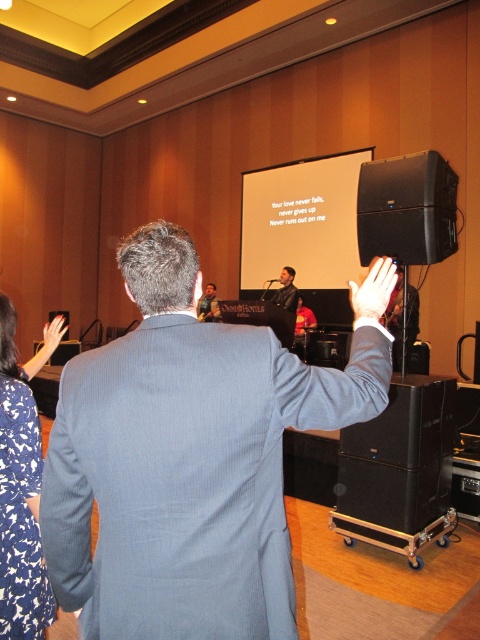
Is black matte speaker at lower right in front of matte black hand at upper left?

No, it is behind matte black hand at upper left.

Is black matte speaker at lower right to the right of matte black hand at upper left from the viewer's perspective?

Correct, you'll find black matte speaker at lower right to the right of matte black hand at upper left.

You are a GUI agent. You are given a task and a screenshot of the screen. Output one action in this format:
    pyautogui.click(x=<x>, y=<y>)
    Task: Click on the black matte speaker at lower right
    The height and width of the screenshot is (640, 480).
    Given the screenshot: What is the action you would take?
    pyautogui.click(x=407, y=209)

I want to click on black matte speaker at lower right, so click(x=407, y=209).

Is point (363, 200) positioned after point (271, 300)?

That is False.

Where is `black matte speaker at lower right`? This screenshot has height=640, width=480. black matte speaker at lower right is located at coordinates (407, 209).

Does blue pinstripe suit at center have a greater height compared to blue floral dress at lower left?

No, blue pinstripe suit at center is not taller than blue floral dress at lower left.

Does blue pinstripe suit at center appear under blue floral dress at lower left?

Incorrect, blue pinstripe suit at center is not positioned below blue floral dress at lower left.

Where is `blue pinstripe suit at center`? The image size is (480, 640). blue pinstripe suit at center is located at coordinates (187, 460).